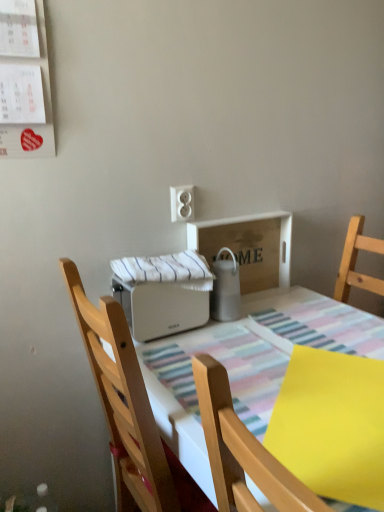
Locate an element on the screen. The height and width of the screenshot is (512, 384). vacant space underneath yellow matte paper at lower right (from a real-world perspective) is located at coordinates (333, 417).